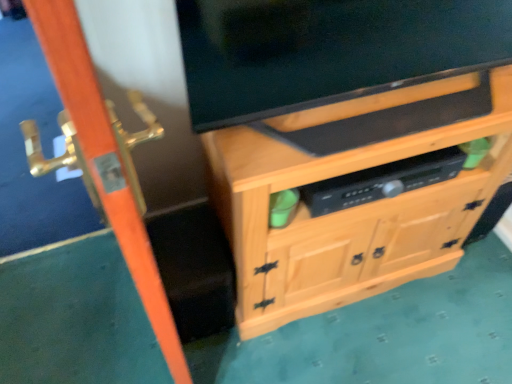
This screenshot has width=512, height=384. Identify the location of vacant area situated below matte black tv at upper center (from a real-world perspective). (x=351, y=120).